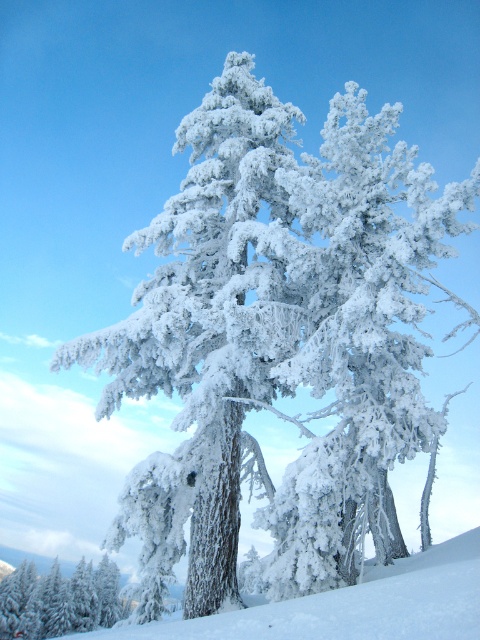
Can you confirm if white snow at center is positioned to the right of white frosty tree at lower left?

Correct, you'll find white snow at center to the right of white frosty tree at lower left.

Can you confirm if white snow at center is positioned to the left of white frosty tree at lower left?

No, white snow at center is not to the left of white frosty tree at lower left.

Between point (453, 580) and point (105, 592), which one is positioned in front?

Point (453, 580)

Where is `white snow at center`? white snow at center is located at coordinates coord(350,605).